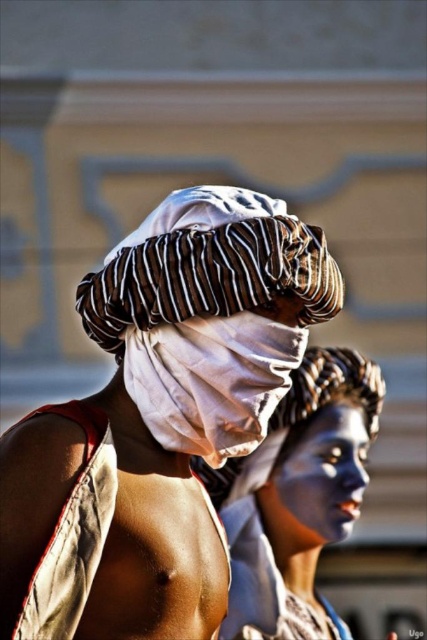
In the image, there are two individuals. The first has a white cloth draping over their face and a striped turban, while the second has a painted face and a similar turban. A point at coordinates (210, 314) marks an object. What object is located at this point?

The point at (210, 314) indicates the white cotton headscarf at center.

You are a photographer trying to capture a detailed shot of the blue matte face paint at center and the blue matte face at center. Which one would appear larger in your photo?

The blue matte face paint at center appears larger because it is closer to the viewer than the blue matte face at center.

You are a photographer trying to capture the best angle of the two individuals in the scene. You notice the white cloth at center and the white cotton headscarf at center. Which object would you focus on if you want to highlight something smaller in size?

The white cloth at center is smaller in size compared to the white cotton headscarf at center, so focusing on the white cloth at center would highlight the smaller object.